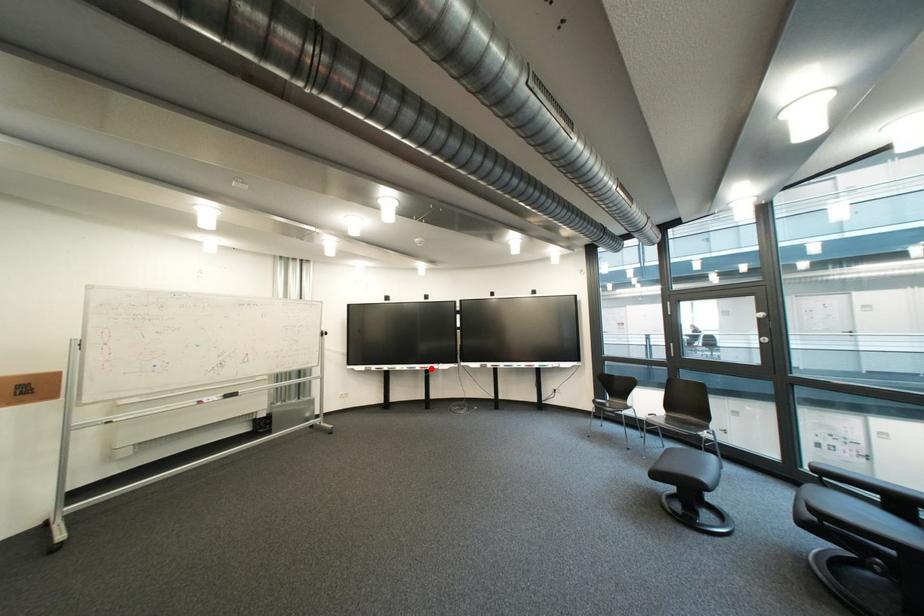
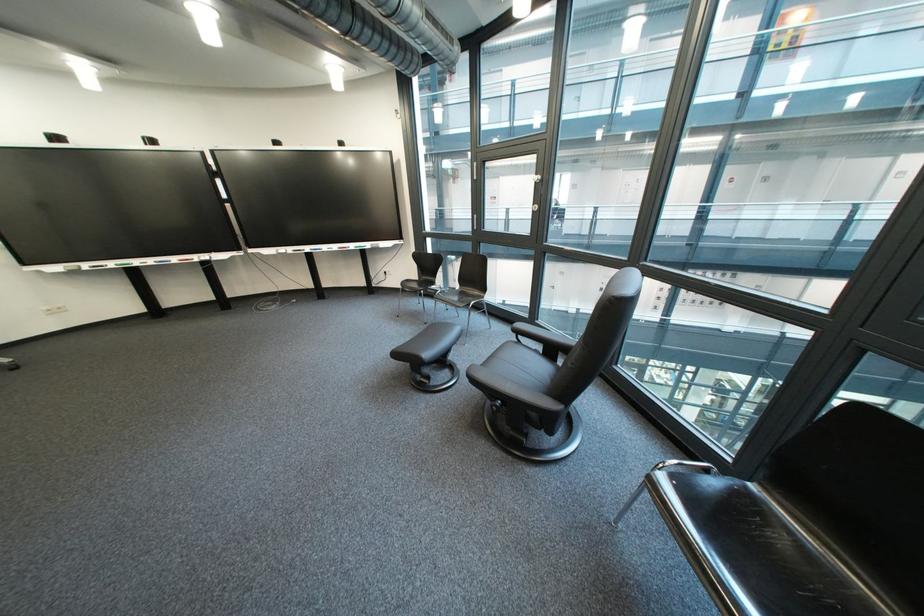
Find the pixel in the second image that matches the highlighted location in the first image.

(188, 261)